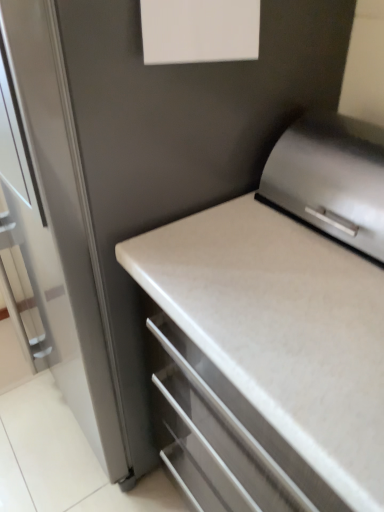
Describe the element at coordinates (331, 179) in the screenshot. I see `satin silver toaster at upper right` at that location.

The width and height of the screenshot is (384, 512). What are the coordinates of `satin silver toaster at upper right` in the screenshot? It's located at (331, 179).

What is the approximate width of satin silver toaster at upper right?

satin silver toaster at upper right is 10.00 inches in width.

Find the location of `satin silver toaster at upper right`. satin silver toaster at upper right is located at coordinates (331, 179).